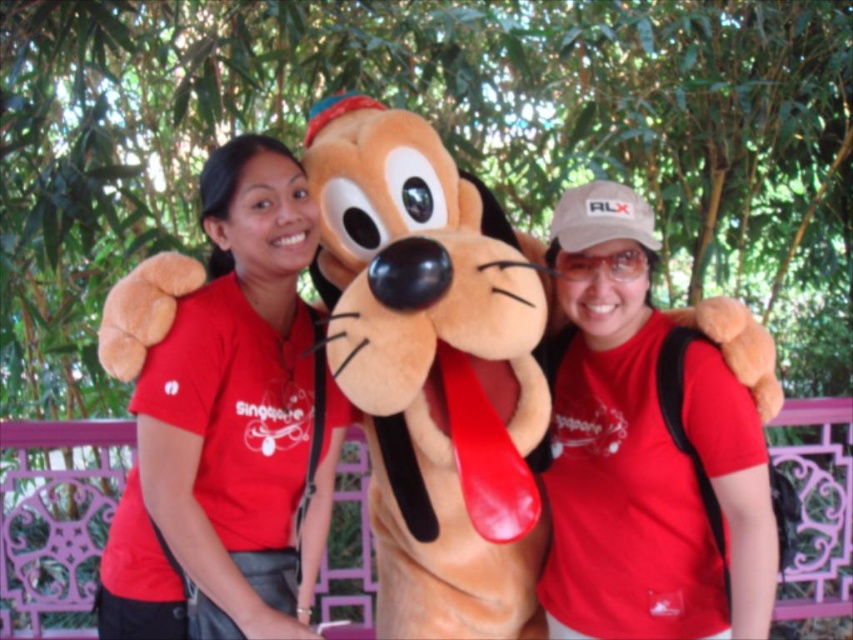
You are taking a photo of the two people and the Pluto plush in the scene. You want to focus on the point at (270, 328) and the point at (563, 595). Which point is closer to the camera?

Point at (270, 328) is closer to the camera than point at (563, 595).